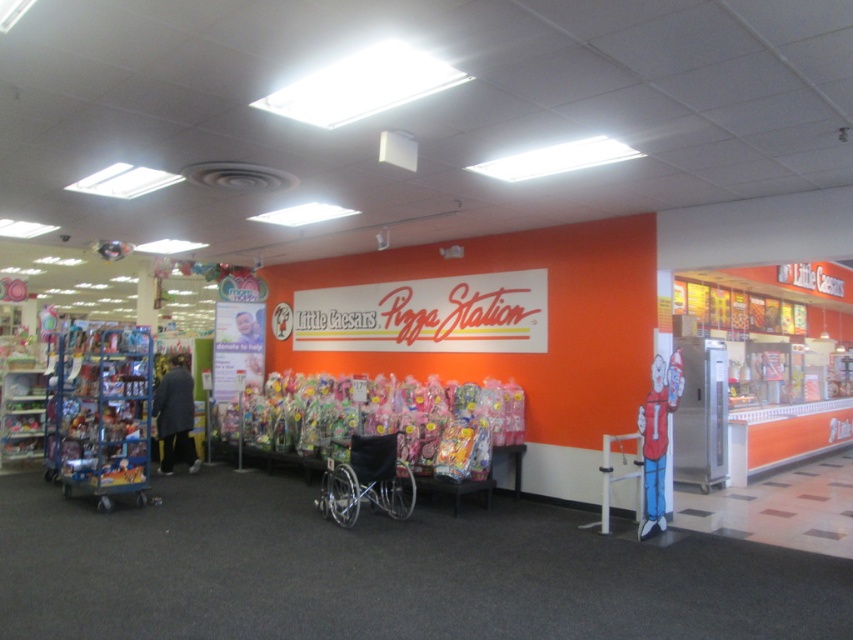
You are a customer in the store and want to buy a gift basket for a child. You see the translucent plastic toys at center and the black plastic wheelchair at center. Which object is closer to the left side of the store?

The translucent plastic toys at center are to the left of the black plastic wheelchair at center, so they are closer to the left side of the store.

You are a customer in the store and want to purchase the translucent plastic toys at center. However, you are using the black plastic wheelchair at center. Can you easily reach the toys?

The translucent plastic toys at center has a larger size compared to black plastic wheelchair at center, which may make it harder to maneuver the black plastic wheelchair at center around or near the toys. However, the exact placement and accessibility would depend on the specific arrangement of the display and surrounding space.